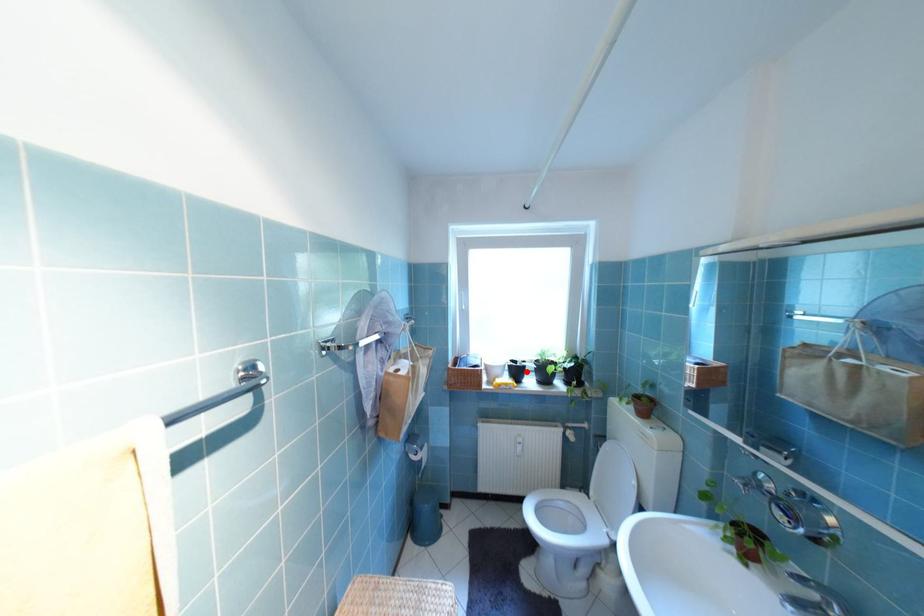
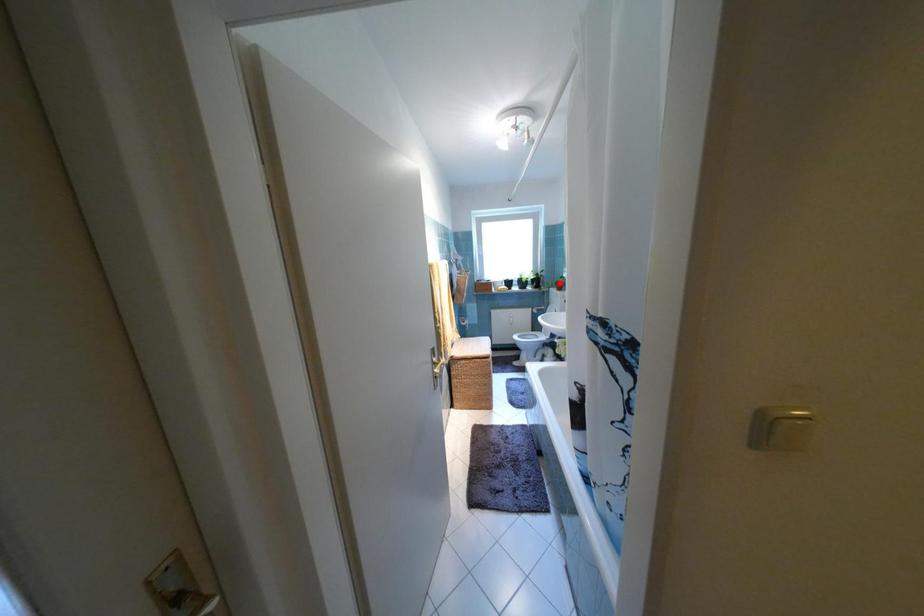
I am providing you with two images of the same scene from different viewpoints. A red point is marked on the first image and another point is marked on the second image. Does the point marked in image1 correspond to the same location as the one in image2?

No